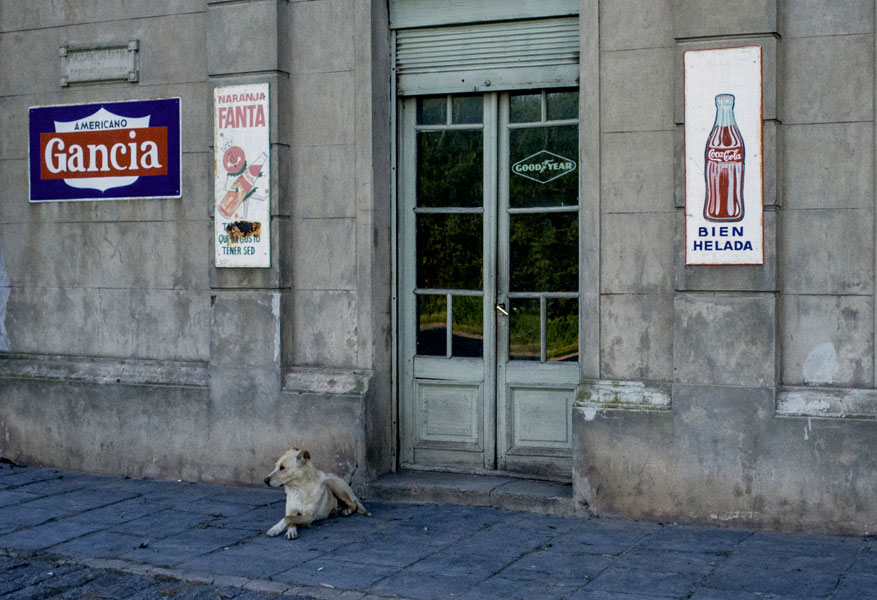
Find the location of a particular element. This screenshot has height=600, width=877. door is located at coordinates (543, 240).